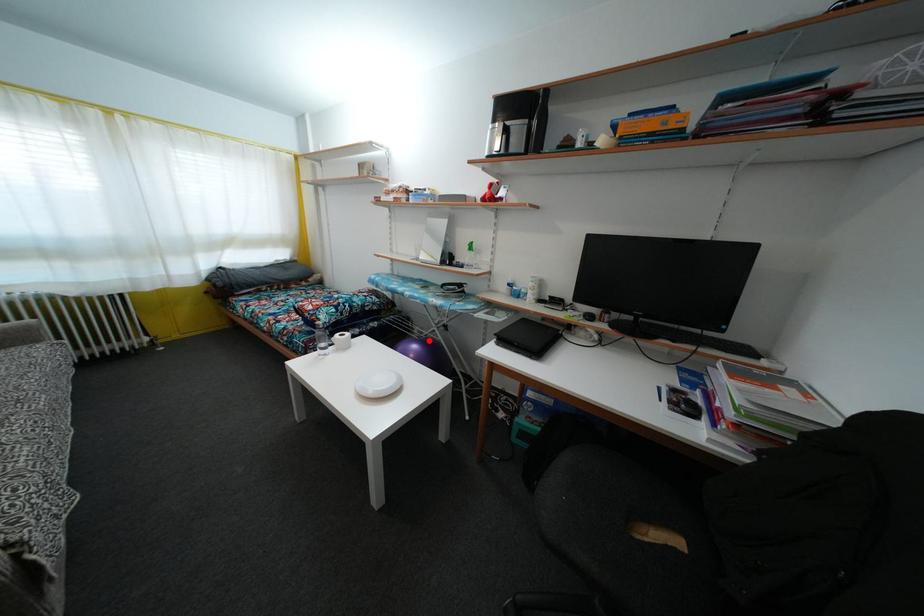
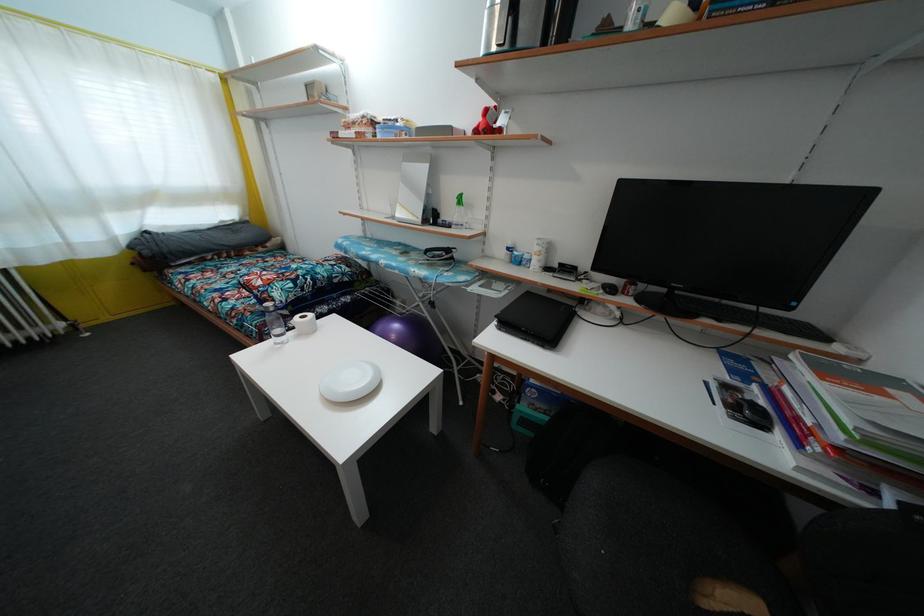
Find the pixel in the second image that matches the highlighted location in the first image.

(411, 315)